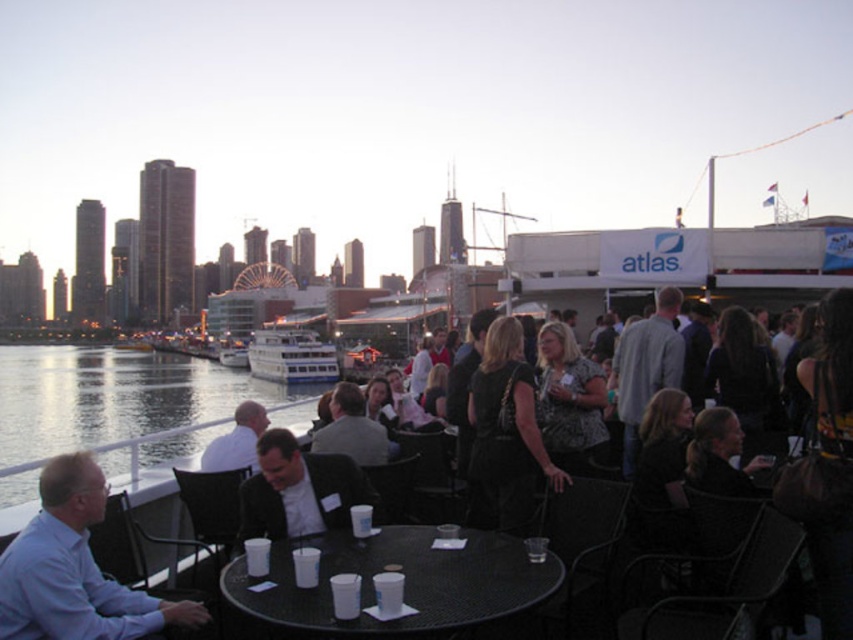
Which is below, white glossy cruise ship at center or white shirt at center?

white shirt at center

How far apart are white glossy cruise ship at center and white shirt at center?

They are 218.67 meters apart.

Between point (311, 353) and point (251, 464), which one is positioned in front?

Point (251, 464)

Where is `white glossy cruise ship at center`? Image resolution: width=853 pixels, height=640 pixels. white glossy cruise ship at center is located at coordinates (291, 356).

Does light gray suit at center have a larger size compared to white shirt at center?

No.

Is light gray suit at center thinner than white shirt at center?

Yes, light gray suit at center is thinner than white shirt at center.

Between point (364, 406) and point (258, 403), which one is positioned in front?

Point (364, 406) is in front.

Locate an element on the screen. light gray suit at center is located at coordinates (351, 429).

Does dark suit at center have a greater width compared to white glossy cruise ship at center?

Incorrect, dark suit at center's width does not surpass white glossy cruise ship at center's.

Can you confirm if dark suit at center is thinner than white glossy cruise ship at center?

Yes.

Where is `dark suit at center`? The height and width of the screenshot is (640, 853). dark suit at center is located at coordinates (299, 490).